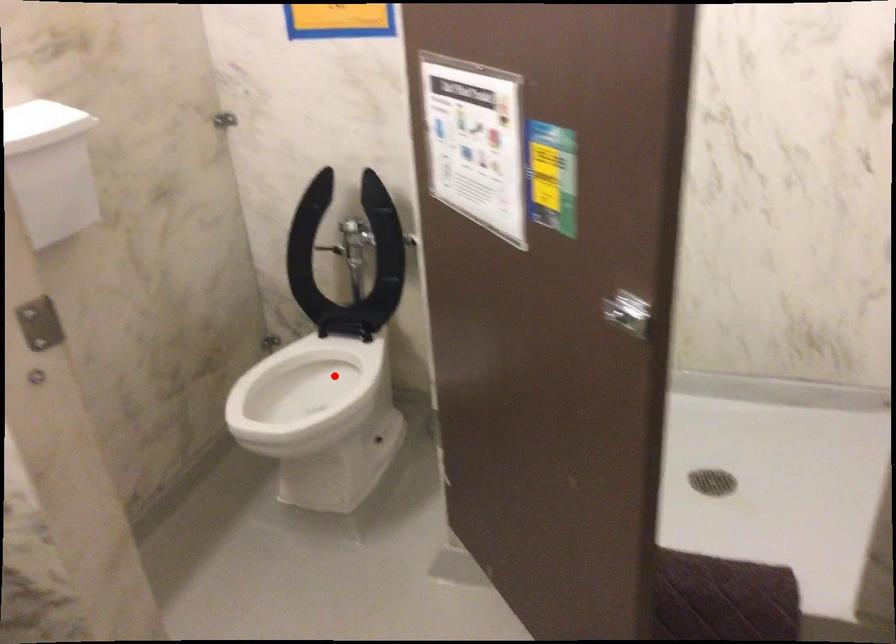
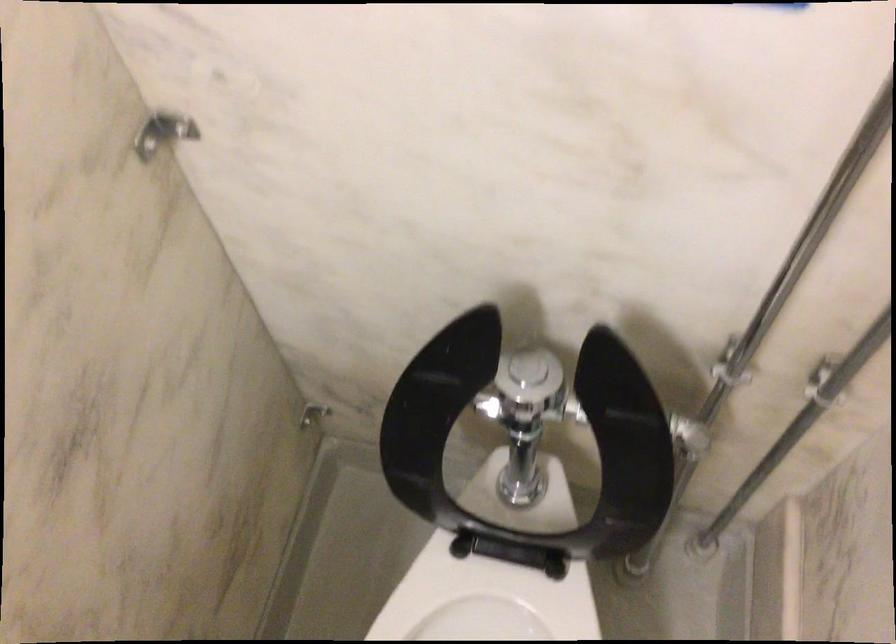
In the second image, find the point that corresponds to the highlighted location in the first image.

(487, 605)